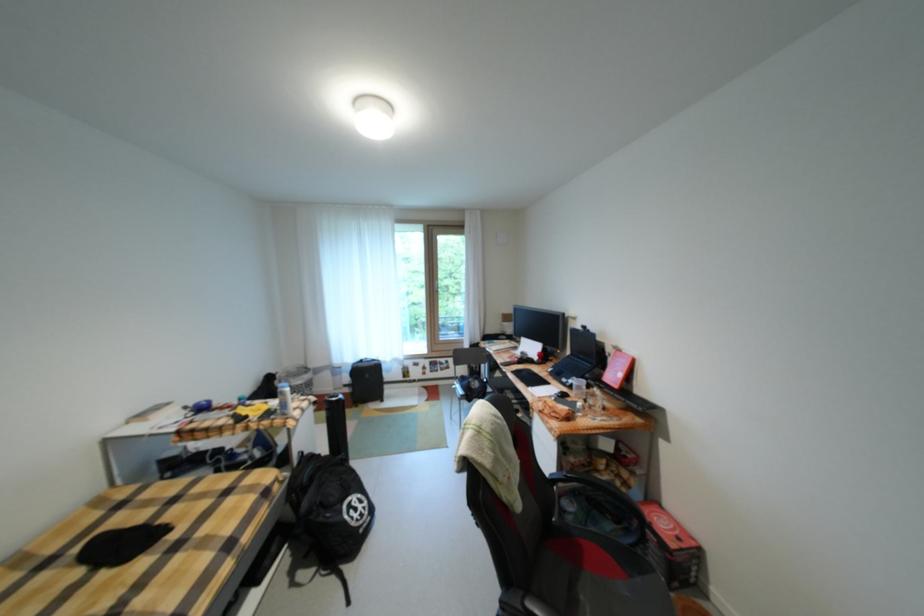
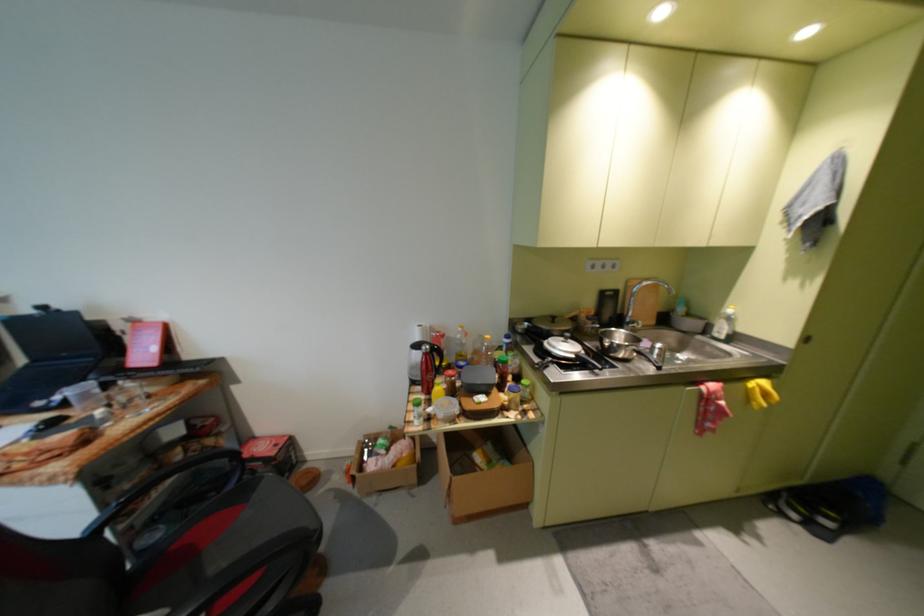
Where in the second image is the point corresponding to (x=596, y=402) from the first image?

(119, 407)